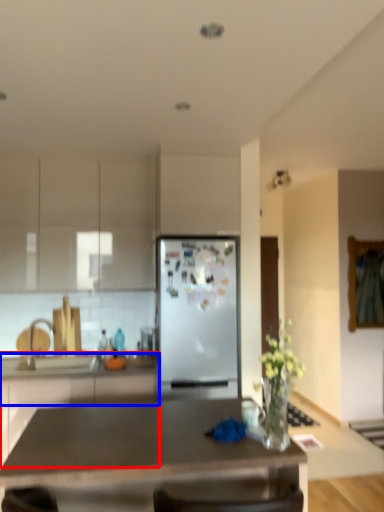
Question: Among these objects, which one is nearest to the camera, cabinetry (highlighted by a red box) or counter top (highlighted by a blue box)?

Choices:
 (A) cabinetry
 (B) counter top

Answer: (A)